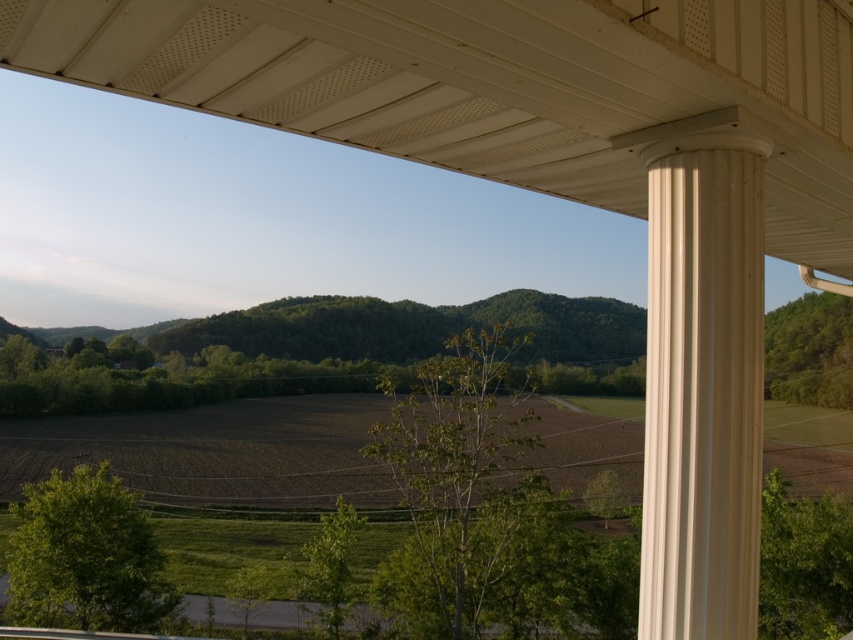
Can you confirm if white textured ceiling at upper center is positioned above white smooth column at right?

Indeed, white textured ceiling at upper center is positioned over white smooth column at right.

Does point (790, 4) come closer to viewer compared to point (759, 468)?

Yes.

This screenshot has width=853, height=640. In order to click on white textured ceiling at upper center in this screenshot , I will do `click(495, 84)`.